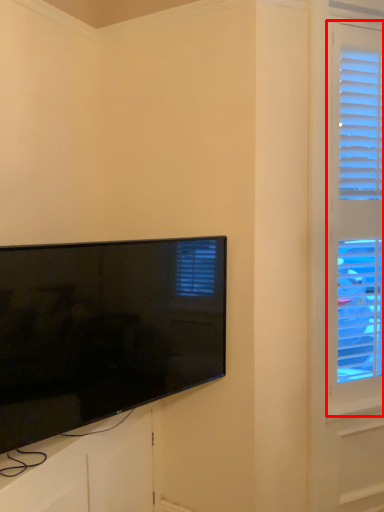
Question: From the image's perspective, what is the correct spatial positioning of window (annotated by the red box) in reference to television?

Choices:
 (A) below
 (B) above

Answer: (B)